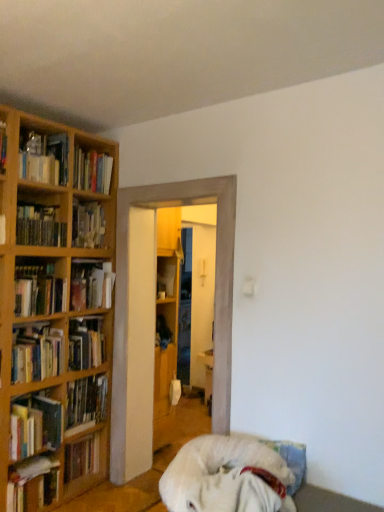
What do you see at coordinates (35, 425) in the screenshot? I see `hardcover book at left, arranged as the 9th book when viewed from the top` at bounding box center [35, 425].

What is the approximate width of wooden bookshelf at center, which ranks as the fourth book in top-to-bottom order?

The width of wooden bookshelf at center, which ranks as the fourth book in top-to-bottom order, is 7.02 inches.

The image size is (384, 512). Identify the location of hardcover book at left, which appears as the seventh book when viewed from the top. (36, 353).

This screenshot has height=512, width=384. What do you see at coordinates (224, 477) in the screenshot?
I see `white fluffy dog at lower center` at bounding box center [224, 477].

In order to click on hardcover book at left, which is counted as the 11th book, starting from the top in this screenshot , I will do `click(33, 484)`.

Does hardcover book at left, which is counted as the 11th book, starting from the top, have a lesser height compared to hardcover book at left, arranged as the 7th book when ordered from the bottom?

Incorrect, the height of hardcover book at left, which is counted as the 11th book, starting from the top, does not fall short of that of hardcover book at left, arranged as the 7th book when ordered from the bottom.

Is point (38, 475) farther from camera compared to point (62, 291)?

That is False.

Is hardcover book at left, acting as the 1th book starting from the bottom, looking in the opposite direction of hardcover book at left, arranged as the 7th book when ordered from the bottom?

No, hardcover book at left, acting as the 1th book starting from the bottom, is not facing away from hardcover book at left, arranged as the 7th book when ordered from the bottom.

At what (x,y) coordinates should I click in order to perform the action: click on book that is the 6th one above the hardcover book at left, acting as the 1th book starting from the bottom (from a real-world perspective). Please return your answer as a coordinate pair (x, y). Looking at the image, I should click on (39, 290).

From the image's perspective, is wooden cabinet at center below hardcover book at left, which appears as the seventh book when viewed from the top?

Yes, from the image's perspective, wooden cabinet at center is below hardcover book at left, which appears as the seventh book when viewed from the top.

Is wooden cabinet at center bigger or smaller than hardcover book at left, which appears as the 5th book when ordered from the bottom?

Considering their sizes, wooden cabinet at center takes up less space than hardcover book at left, which appears as the 5th book when ordered from the bottom.

Would you say wooden cabinet at center is outside hardcover book at left, which appears as the 5th book when ordered from the bottom?

wooden cabinet at center is positioned outside hardcover book at left, which appears as the 5th book when ordered from the bottom.

In the image, is hardcover book at left, arranged as the 9th book when viewed from the top, on the left side or the right side of matte wooden bookshelf at left, the eleventh book positioned from the bottom?

hardcover book at left, arranged as the 9th book when viewed from the top, is positioned on matte wooden bookshelf at left, the eleventh book positioned from the bottom,'s right side.

I want to click on the 5th book in front of the matte wooden bookshelf at left, marked as the 1th book in a top-to-bottom arrangement, starting your count from the anchor, so click(x=35, y=425).

How much distance is there between hardcover book at left, the 3th book positioned from the bottom, and matte wooden bookshelf at left, marked as the 1th book in a top-to-bottom arrangement?

hardcover book at left, the 3th book positioned from the bottom, is 1.48 meters away from matte wooden bookshelf at left, marked as the 1th book in a top-to-bottom arrangement.

How different are the orientations of hardcover book at left, the 3th book positioned from the bottom, and matte wooden bookshelf at left, the eleventh book positioned from the bottom, in degrees?

There is a 0.000127-degree angle between the facing directions of hardcover book at left, the 3th book positioned from the bottom, and matte wooden bookshelf at left, the eleventh book positioned from the bottom.

Considering the points (31, 143) and (17, 279), which point is behind, point (31, 143) or point (17, 279)?

The point (31, 143) is more distant.

Considering the positions of objects matte wooden bookshelf at left, the eleventh book positioned from the bottom, and hardcover book at left, acting as the 5th book starting from the top, in the image provided, who is behind, matte wooden bookshelf at left, the eleventh book positioned from the bottom, or hardcover book at left, acting as the 5th book starting from the top,?

matte wooden bookshelf at left, the eleventh book positioned from the bottom, is further from the camera.

Considering the sizes of objects matte wooden bookshelf at left, marked as the 1th book in a top-to-bottom arrangement, and hardcover book at left, arranged as the 7th book when ordered from the bottom, in the image provided, who is bigger, matte wooden bookshelf at left, marked as the 1th book in a top-to-bottom arrangement, or hardcover book at left, arranged as the 7th book when ordered from the bottom,?

Bigger between the two is matte wooden bookshelf at left, marked as the 1th book in a top-to-bottom arrangement.

In terms of width, does matte wooden bookshelf at left, the eleventh book positioned from the bottom, look wider or thinner when compared to hardcover book at left, acting as the 5th book starting from the top?

In the image, matte wooden bookshelf at left, the eleventh book positioned from the bottom, appears to be wider than hardcover book at left, acting as the 5th book starting from the top.

Looking at the image, does hardcover book at left, which is the second book from bottom to top, seem bigger or smaller compared to hardcover book at left, acting as the 9th book starting from the bottom?

Clearly, hardcover book at left, which is the second book from bottom to top, is smaller in size than hardcover book at left, acting as the 9th book starting from the bottom.

Would you say hardcover book at left, positioned as the tenth book in top-to-bottom order, is to the left or to the right of hardcover book at left, the third book when ordered from top to bottom, in the picture?

Based on their positions, hardcover book at left, positioned as the tenth book in top-to-bottom order, is located to the left of hardcover book at left, the third book when ordered from top to bottom.

Is hardcover book at left, positioned as the tenth book in top-to-bottom order, facing towards hardcover book at left, acting as the 9th book starting from the bottom?

No.

Is hardcover book at left, which is the second book from bottom to top, wider or thinner than hardcover book at left, the third book when ordered from top to bottom?

Clearly, hardcover book at left, which is the second book from bottom to top, has less width compared to hardcover book at left, the third book when ordered from top to bottom.

Is hardcover book at left, acting as the 9th book starting from the bottom, inside the boundaries of hardcover book at left, acting as the 1th book starting from the bottom, or outside?

hardcover book at left, acting as the 9th book starting from the bottom, is not enclosed by hardcover book at left, acting as the 1th book starting from the bottom.

Is the surface of hardcover book at left, acting as the 9th book starting from the bottom, in direct contact with hardcover book at left, which is counted as the 11th book, starting from the top?

hardcover book at left, acting as the 9th book starting from the bottom, and hardcover book at left, which is counted as the 11th book, starting from the top, are not in contact.

From a real-world perspective, between hardcover book at left, the third book when ordered from top to bottom, and hardcover book at left, which is counted as the 11th book, starting from the top, who is vertically lower?

hardcover book at left, which is counted as the 11th book, starting from the top.

From the image's perspective, which is above, hardcover book at left, the third book when ordered from top to bottom, or hardcover book at left, acting as the 1th book starting from the bottom?

hardcover book at left, the third book when ordered from top to bottom.

Is hardcover book at left, which is counted as the 11th book, starting from the top, facing away from wooden bookshelf at left, arranged as the tenth book when ordered from the bottom?

No.

Looking at this image, from a real-world perspective, is hardcover book at left, which is counted as the 11th book, starting from the top, located beneath wooden bookshelf at left, the second book when ordered from top to bottom?

Yes, from a real-world perspective, hardcover book at left, which is counted as the 11th book, starting from the top, is below wooden bookshelf at left, the second book when ordered from top to bottom.

How distant is hardcover book at left, which is counted as the 11th book, starting from the top, from wooden bookshelf at left, the second book when ordered from top to bottom?

hardcover book at left, which is counted as the 11th book, starting from the top, and wooden bookshelf at left, the second book when ordered from top to bottom, are 4.63 feet apart from each other.

From the image's perspective, count 6th books downward from the hardcover book at left, acting as the 5th book starting from the top, and point to it. Please provide its 2D coordinates.

[(33, 484)]

You are a GUI agent. You are given a task and a screenshot of the screen. Output one action in this format:
    pyautogui.click(x=<x>, y=<y>)
    Task: Click on the cabinet that is above the hardcover book at left, which appears as the 5th book when ordered from the bottom (from a real-world perspective)
    The height and width of the screenshot is (512, 384).
    Given the screenshot: What is the action you would take?
    pos(163,332)

Considering their positions, is hardcover book at left, which appears as the seventh book when viewed from the top, positioned closer to hardcover book at left, acting as the 1th book starting from the bottom, than hardcover book at left, which is the second book from bottom to top?

hardcover book at left, which is the second book from bottom to top.

From the image, which object appears to be nearer to wooden bookshelf at left, hardcover book at left, arranged as the 7th book when ordered from the bottom, or hardcover book at left, the third book when ordered from top to bottom?

Based on the image, hardcover book at left, the third book when ordered from top to bottom, appears to be nearer to wooden bookshelf at left.

Which object lies further to the anchor point matte wooden bookshelf at left, marked as the 1th book in a top-to-bottom arrangement, white fluffy dog at lower center or hardcover book at left, acting as the eighth book starting from the top?

white fluffy dog at lower center is positioned further to the anchor matte wooden bookshelf at left, marked as the 1th book in a top-to-bottom arrangement.

From the image, which object appears to be nearer to white fluffy dog at lower center, wooden bookshelf at left, arranged as the tenth book when ordered from the bottom, or wooden bookshelf at left, which ranks as the sixth book in bottom-to-top order?

wooden bookshelf at left, which ranks as the sixth book in bottom-to-top order, lies closer to white fluffy dog at lower center than the other object.

Based on their spatial positions, is wooden bookshelf at left, which ranks as the 6th book in top-to-bottom order, or wooden bookshelf at left, arranged as the tenth book when ordered from the bottom, closer to hardcover book at left, which appears as the seventh book when viewed from the top?

wooden bookshelf at left, which ranks as the 6th book in top-to-bottom order, is closer to hardcover book at left, which appears as the seventh book when viewed from the top.

Estimate the real-world distances between objects in this image. Which object is closer to hardcover book at left, which is the second book from bottom to top, hardcover book at left, which appears as the 5th book when ordered from the bottom, or hardcover book at left, acting as the eighth book starting from the top?

Based on the image, hardcover book at left, acting as the eighth book starting from the top, appears to be nearer to hardcover book at left, which is the second book from bottom to top.

Based on their spatial positions, is matte wooden bookshelf at left, marked as the 1th book in a top-to-bottom arrangement, or white fluffy dog at lower center further from wooden bookshelf at center, the eighth book when ordered from bottom to top?

white fluffy dog at lower center lies further to wooden bookshelf at center, the eighth book when ordered from bottom to top, than the other object.

When comparing their distances from hardcover book at left, acting as the 5th book starting from the top, does wooden bookshelf at center, which ranks as the fourth book in top-to-bottom order, or white fluffy dog at lower center seem closer?

Among the two, wooden bookshelf at center, which ranks as the fourth book in top-to-bottom order, is located nearer to hardcover book at left, acting as the 5th book starting from the top.

Where is `entertainment center between hardcover book at left, which appears as the seventh book when viewed from the top, and wooden cabinet at center, along the z-axis`? Image resolution: width=384 pixels, height=512 pixels. entertainment center between hardcover book at left, which appears as the seventh book when viewed from the top, and wooden cabinet at center, along the z-axis is located at coordinates (155, 314).

The width and height of the screenshot is (384, 512). What are the coordinates of `entertainment center between wooden bookshelf at left, arranged as the tenth book when ordered from the bottom, and hardcover book at left, which is counted as the 11th book, starting from the top, from top to bottom` in the screenshot? It's located at (155, 314).

At what (x,y) coordinates should I click in order to perform the action: click on entertainment center between white fluffy dog at lower center and hardcover book at left, acting as the eighth book starting from the top, from front to back. Please return your answer as a coordinate pair (x, y). This screenshot has width=384, height=512. Looking at the image, I should click on (155, 314).

Locate an element on the screen. The image size is (384, 512). entertainment center located between wooden bookshelf at left, the second book when ordered from top to bottom, and wooden bookshelf at center, the eighth book when ordered from bottom to top, in the depth direction is located at coordinates (155, 314).